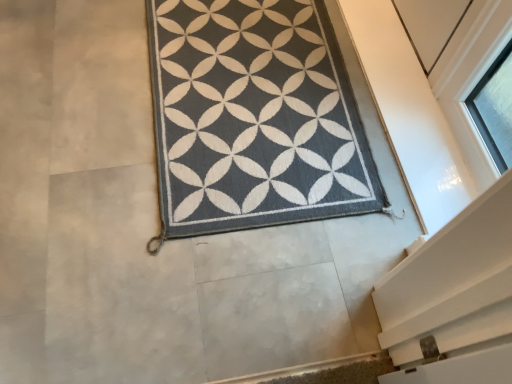
The image size is (512, 384). What are the coordinates of `free space in front of dark gray textured rug at center` in the screenshot? It's located at (187, 273).